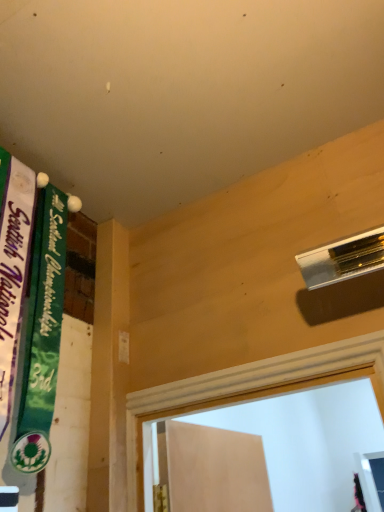
You are a GUI agent. You are given a task and a screenshot of the screen. Output one action in this format:
    pyautogui.click(x=<x>, y=<y>)
    Task: Click on the green fabric banner at left, which appears as the second bulletin board when viewed from the right
    The height and width of the screenshot is (512, 384).
    Given the screenshot: What is the action you would take?
    pyautogui.click(x=13, y=273)

What do you see at coordinates (13, 273) in the screenshot? I see `green fabric banner at left, which appears as the second bulletin board when viewed from the right` at bounding box center [13, 273].

This screenshot has height=512, width=384. What do you see at coordinates (42, 333) in the screenshot?
I see `green fabric banner at upper left, placed as the first bulletin board when sorted from right to left` at bounding box center [42, 333].

Measure the distance between green fabric banner at upper left, which is counted as the 2th bulletin board, starting from the left, and camera.

The distance of green fabric banner at upper left, which is counted as the 2th bulletin board, starting from the left, from camera is 1.05 meters.

You are a GUI agent. You are given a task and a screenshot of the screen. Output one action in this format:
    pyautogui.click(x=<x>, y=<y>)
    Task: Click on the green fabric banner at upper left, placed as the first bulletin board when sorted from right to left
    This screenshot has height=512, width=384.
    Given the screenshot: What is the action you would take?
    pyautogui.click(x=42, y=333)

How much space does green fabric banner at upper left, which is counted as the 2th bulletin board, starting from the left, occupy vertically?

It is 34.48 inches.

Where is `green fabric banner at left, which appears as the second bulletin board when viewed from the right`? The image size is (384, 512). green fabric banner at left, which appears as the second bulletin board when viewed from the right is located at coordinates (13, 273).

Considering the relative positions of green fabric banner at upper left, placed as the first bulletin board when sorted from right to left, and green fabric banner at left, placed as the first bulletin board when sorted from left to right, in the image provided, is green fabric banner at upper left, placed as the first bulletin board when sorted from right to left, to the left of green fabric banner at left, placed as the first bulletin board when sorted from left to right, from the viewer's perspective?

No, green fabric banner at upper left, placed as the first bulletin board when sorted from right to left, is not to the left of green fabric banner at left, placed as the first bulletin board when sorted from left to right.

Considering their positions, is green fabric banner at upper left, placed as the first bulletin board when sorted from right to left, located in front of or behind green fabric banner at left, which appears as the second bulletin board when viewed from the right?

In the image, green fabric banner at upper left, placed as the first bulletin board when sorted from right to left, appears behind green fabric banner at left, which appears as the second bulletin board when viewed from the right.

Does point (31, 280) come farther from viewer compared to point (31, 179)?

No, it is not.

From the image's perspective, is green fabric banner at upper left, which is counted as the 2th bulletin board, starting from the left, positioned above or below green fabric banner at left, placed as the first bulletin board when sorted from left to right?

Clearly, from the image's perspective, green fabric banner at upper left, which is counted as the 2th bulletin board, starting from the left, is below green fabric banner at left, placed as the first bulletin board when sorted from left to right.

From a real-world perspective, is green fabric banner at upper left, which is counted as the 2th bulletin board, starting from the left, physically below green fabric banner at left, placed as the first bulletin board when sorted from left to right?

Incorrect, from a real-world perspective, green fabric banner at upper left, which is counted as the 2th bulletin board, starting from the left, is higher than green fabric banner at left, placed as the first bulletin board when sorted from left to right.

Considering the sizes of objects green fabric banner at upper left, placed as the first bulletin board when sorted from right to left, and green fabric banner at left, placed as the first bulletin board when sorted from left to right, in the image provided, who is wider, green fabric banner at upper left, placed as the first bulletin board when sorted from right to left, or green fabric banner at left, placed as the first bulletin board when sorted from left to right,?

green fabric banner at upper left, placed as the first bulletin board when sorted from right to left.

Can you confirm if green fabric banner at upper left, placed as the first bulletin board when sorted from right to left, is shorter than green fabric banner at left, which appears as the second bulletin board when viewed from the right?

Indeed, green fabric banner at upper left, placed as the first bulletin board when sorted from right to left, has a lesser height compared to green fabric banner at left, which appears as the second bulletin board when viewed from the right.

Can you confirm if green fabric banner at upper left, which is counted as the 2th bulletin board, starting from the left, is smaller than green fabric banner at left, placed as the first bulletin board when sorted from left to right?

Correct, green fabric banner at upper left, which is counted as the 2th bulletin board, starting from the left, occupies less space than green fabric banner at left, placed as the first bulletin board when sorted from left to right.

Which is correct: green fabric banner at upper left, placed as the first bulletin board when sorted from right to left, is inside green fabric banner at left, which appears as the second bulletin board when viewed from the right, or outside of it?

green fabric banner at upper left, placed as the first bulletin board when sorted from right to left, is not enclosed by green fabric banner at left, which appears as the second bulletin board when viewed from the right.

Are green fabric banner at upper left, placed as the first bulletin board when sorted from right to left, and green fabric banner at left, which appears as the second bulletin board when viewed from the right, making contact?

Yes, green fabric banner at upper left, placed as the first bulletin board when sorted from right to left, is in contact with green fabric banner at left, which appears as the second bulletin board when viewed from the right.

Is green fabric banner at upper left, placed as the first bulletin board when sorted from right to left, facing towards green fabric banner at left, which appears as the second bulletin board when viewed from the right?

No, green fabric banner at upper left, placed as the first bulletin board when sorted from right to left, is not aimed at green fabric banner at left, which appears as the second bulletin board when viewed from the right.

Locate an element on the screen. This screenshot has width=384, height=512. bulletin board that is above the green fabric banner at left, which appears as the second bulletin board when viewed from the right (from a real-world perspective) is located at coordinates (42, 333).

In the image, is green fabric banner at left, placed as the first bulletin board when sorted from left to right, on the left side or the right side of green fabric banner at upper left, placed as the first bulletin board when sorted from right to left?

From the image, it's evident that green fabric banner at left, placed as the first bulletin board when sorted from left to right, is to the left of green fabric banner at upper left, placed as the first bulletin board when sorted from right to left.

Considering their positions, is green fabric banner at left, placed as the first bulletin board when sorted from left to right, located in front of or behind green fabric banner at upper left, which is counted as the 2th bulletin board, starting from the left?

In the image, green fabric banner at left, placed as the first bulletin board when sorted from left to right, appears in front of green fabric banner at upper left, which is counted as the 2th bulletin board, starting from the left.

Does point (22, 197) come behind point (42, 452)?

Yes, it is.

From the image's perspective, is green fabric banner at left, which appears as the second bulletin board when viewed from the right, positioned above or below green fabric banner at upper left, which is counted as the 2th bulletin board, starting from the left?

From the image's perspective, green fabric banner at left, which appears as the second bulletin board when viewed from the right, appears above green fabric banner at upper left, which is counted as the 2th bulletin board, starting from the left.

From a real-world perspective, is green fabric banner at left, which appears as the second bulletin board when viewed from the right, physically above green fabric banner at upper left, placed as the first bulletin board when sorted from right to left?

Actually, green fabric banner at left, which appears as the second bulletin board when viewed from the right, is physically below green fabric banner at upper left, placed as the first bulletin board when sorted from right to left, in the real world.

Which of these two, green fabric banner at left, which appears as the second bulletin board when viewed from the right, or green fabric banner at upper left, placed as the first bulletin board when sorted from right to left, is thinner?

green fabric banner at left, which appears as the second bulletin board when viewed from the right, is thinner.

Considering the relative sizes of green fabric banner at left, which appears as the second bulletin board when viewed from the right, and green fabric banner at upper left, placed as the first bulletin board when sorted from right to left, in the image provided, is green fabric banner at left, which appears as the second bulletin board when viewed from the right, shorter than green fabric banner at upper left, placed as the first bulletin board when sorted from right to left,?

Incorrect, the height of green fabric banner at left, which appears as the second bulletin board when viewed from the right, does not fall short of that of green fabric banner at upper left, placed as the first bulletin board when sorted from right to left.

In terms of size, does green fabric banner at left, which appears as the second bulletin board when viewed from the right, appear bigger or smaller than green fabric banner at upper left, which is counted as the 2th bulletin board, starting from the left?

Clearly, green fabric banner at left, which appears as the second bulletin board when viewed from the right, is larger in size than green fabric banner at upper left, which is counted as the 2th bulletin board, starting from the left.

From the picture: Would you say green fabric banner at left, which appears as the second bulletin board when viewed from the right, is inside or outside green fabric banner at upper left, placed as the first bulletin board when sorted from right to left?

The correct answer is: outside.

Does green fabric banner at left, placed as the first bulletin board when sorted from left to right, touch green fabric banner at upper left, which is counted as the 2th bulletin board, starting from the left?

Yes, green fabric banner at left, placed as the first bulletin board when sorted from left to right, is beside green fabric banner at upper left, which is counted as the 2th bulletin board, starting from the left.

In the scene shown: Is green fabric banner at left, placed as the first bulletin board when sorted from left to right, oriented away from green fabric banner at upper left, placed as the first bulletin board when sorted from right to left?

green fabric banner at left, placed as the first bulletin board when sorted from left to right, does not have its back to green fabric banner at upper left, placed as the first bulletin board when sorted from right to left.

How many degrees apart are the facing directions of green fabric banner at left, placed as the first bulletin board when sorted from left to right, and green fabric banner at upper left, placed as the first bulletin board when sorted from right to left?

green fabric banner at left, placed as the first bulletin board when sorted from left to right, and green fabric banner at upper left, placed as the first bulletin board when sorted from right to left, are facing 0.00702 degrees away from each other.

How much distance is there between green fabric banner at left, placed as the first bulletin board when sorted from left to right, and green fabric banner at upper left, placed as the first bulletin board when sorted from right to left?

They are 7.99 centimeters apart.

The image size is (384, 512). What are the coordinates of `bulletin board above the green fabric banner at upper left, which is counted as the 2th bulletin board, starting from the left (from the image's perspective)` in the screenshot? It's located at (13, 273).

The height and width of the screenshot is (512, 384). In order to click on bulletin board that is on the left side of green fabric banner at upper left, placed as the first bulletin board when sorted from right to left in this screenshot , I will do `click(13, 273)`.

Find the location of `bulletin board above the green fabric banner at left, which appears as the second bulletin board when viewed from the right (from a real-world perspective)`. bulletin board above the green fabric banner at left, which appears as the second bulletin board when viewed from the right (from a real-world perspective) is located at coordinates (42, 333).